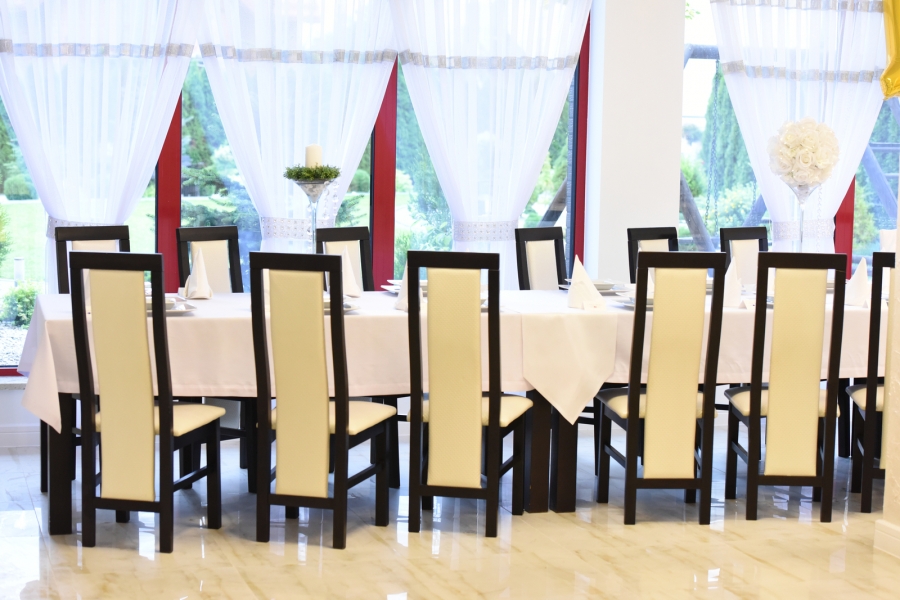
Where is `curtains`? curtains is located at coordinates (72, 113), (291, 136), (477, 93), (806, 98).